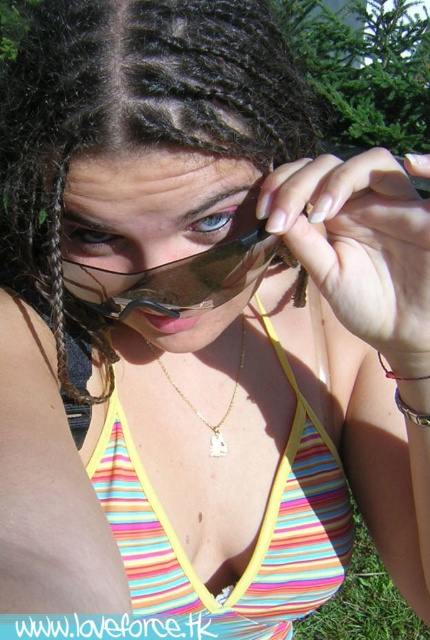
Is point (83, 40) farther from camera compared to point (355, 627)?

No, it is in front of (355, 627).

Is point (14, 157) closer to viewer compared to point (380, 600)?

That is True.

Measure the distance between point [183,97] and camera.

They are 14.60 inches apart.

Image resolution: width=430 pixels, height=640 pixels. I want to click on black braids at center, so tap(132, 118).

Does black braids at center appear on the right side of multicolored striped bikini top at center?

Incorrect, black braids at center is not on the right side of multicolored striped bikini top at center.

This screenshot has width=430, height=640. Find the location of `black braids at center`. black braids at center is located at coordinates tap(132, 118).

Where is `black braids at center`? The image size is (430, 640). black braids at center is located at coordinates (132, 118).

Where is `black braids at center`? black braids at center is located at coordinates (132, 118).

Does point (398, 400) come closer to viewer compared to point (409, 378)?

No, it is not.

Does silver metallic bracelet at lower right have a larger size compared to red string bracelet at lower right?

No.

Image resolution: width=430 pixels, height=640 pixels. I want to click on silver metallic bracelet at lower right, so click(411, 412).